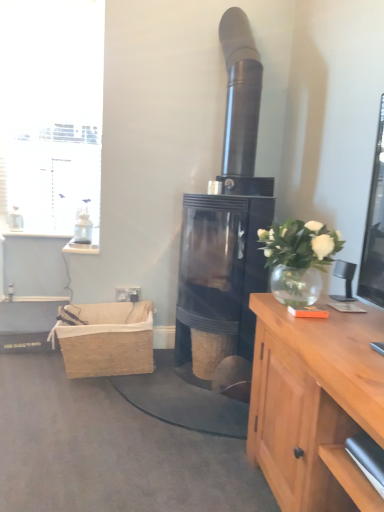
Question: Could you tell me if white glass window at upper left is turned towards black glass fireplace at center?

Choices:
 (A) yes
 (B) no

Answer: (B)

Question: From the image's perspective, is white glass window at upper left located above black glass fireplace at center?

Choices:
 (A) no
 (B) yes

Answer: (B)

Question: Is white glass window at upper left looking in the opposite direction of black glass fireplace at center?

Choices:
 (A) yes
 (B) no

Answer: (B)

Question: Does white glass window at upper left appear on the right side of black glass fireplace at center?

Choices:
 (A) yes
 (B) no

Answer: (B)

Question: From the image's perspective, is white glass window at upper left beneath black glass fireplace at center?

Choices:
 (A) yes
 (B) no

Answer: (B)

Question: Is white glass window at upper left closer to the viewer compared to black glass fireplace at center?

Choices:
 (A) yes
 (B) no

Answer: (B)

Question: From a real-world perspective, is woven brown basket at center under burlap picnic basket at lower left?

Choices:
 (A) yes
 (B) no

Answer: (A)

Question: Can you confirm if woven brown basket at center is positioned to the right of burlap picnic basket at lower left?

Choices:
 (A) no
 (B) yes

Answer: (B)

Question: Does woven brown basket at center have a greater width compared to burlap picnic basket at lower left?

Choices:
 (A) yes
 (B) no

Answer: (B)

Question: Considering the relative sizes of woven brown basket at center and burlap picnic basket at lower left in the image provided, is woven brown basket at center smaller than burlap picnic basket at lower left?

Choices:
 (A) no
 (B) yes

Answer: (B)

Question: From the image's perspective, would you say woven brown basket at center is positioned over burlap picnic basket at lower left?

Choices:
 (A) no
 (B) yes

Answer: (A)

Question: Considering the relative sizes of woven brown basket at center and burlap picnic basket at lower left in the image provided, is woven brown basket at center taller than burlap picnic basket at lower left?

Choices:
 (A) yes
 (B) no

Answer: (B)

Question: From the image's perspective, is white glass vase at upper right located beneath burlap picnic basket at lower left?

Choices:
 (A) yes
 (B) no

Answer: (B)